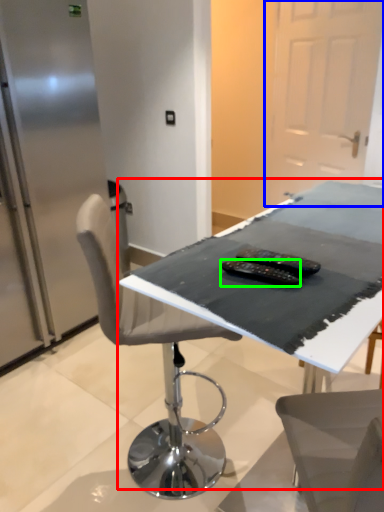
Question: Which object is positioned closest to table (highlighted by a red box)? Select from glass door (highlighted by a blue box) and equipment (highlighted by a green box).

Choices:
 (A) glass door
 (B) equipment

Answer: (B)